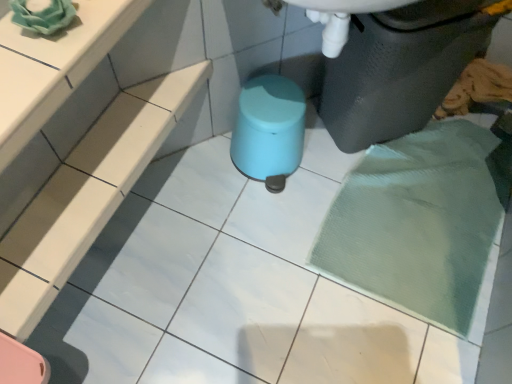
Where is `vacant area that lies to the right of matte plastic waste container at lower right`? Image resolution: width=512 pixels, height=384 pixels. vacant area that lies to the right of matte plastic waste container at lower right is located at coordinates (466, 161).